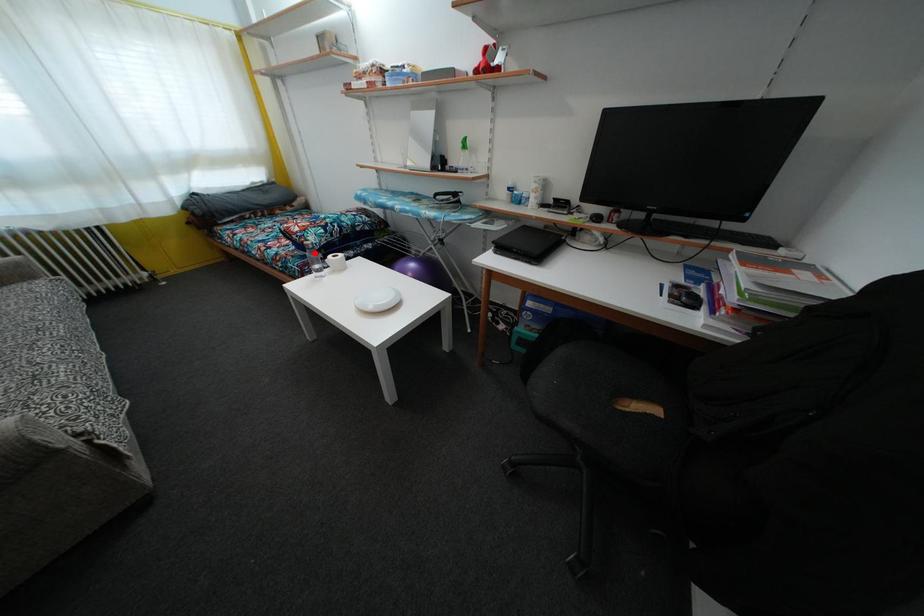
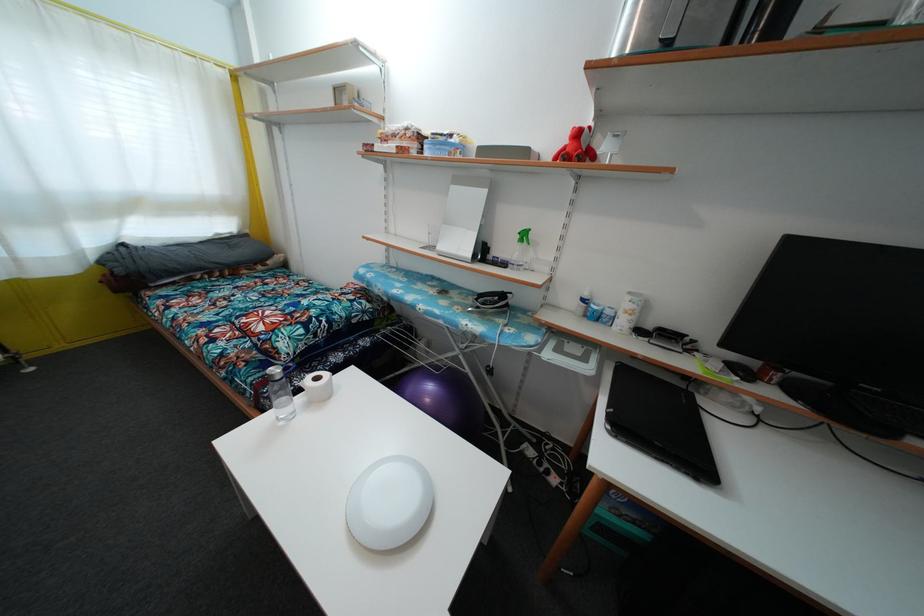
The point at the highlighted location is marked in the first image. Where is the corresponding point in the second image?

(282, 384)